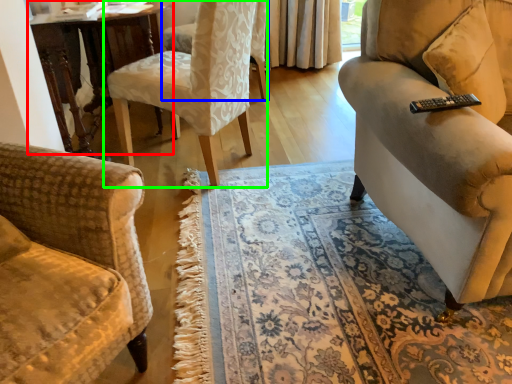
Question: Considering the real-world distances, which object is closest to table (highlighted by a red box)? chair (highlighted by a blue box) or chair (highlighted by a green box).

Choices:
 (A) chair
 (B) chair

Answer: (B)